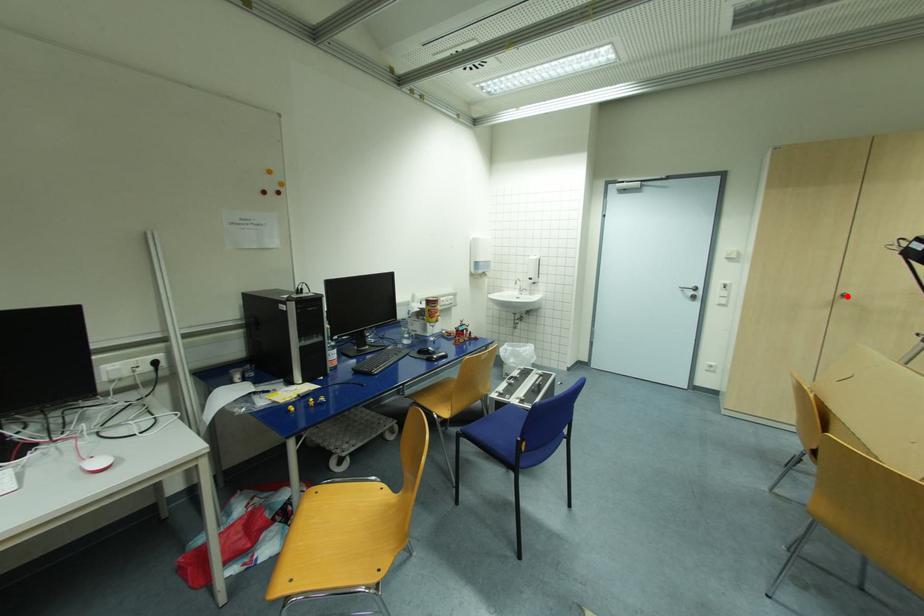
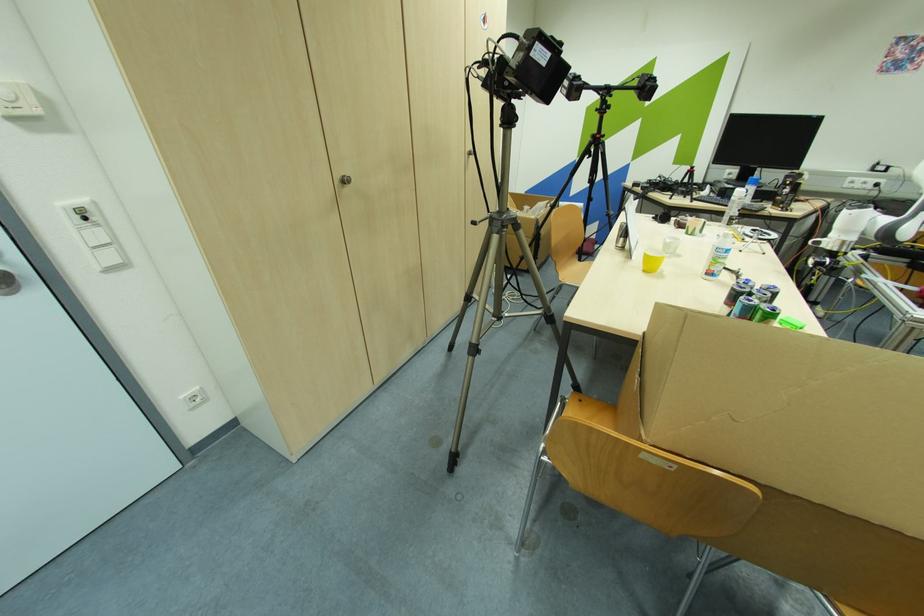
Question: A red point is marked in image1. In image2, is the corresponding 3D point closer to the camera or farther? Reply with the corresponding letter.

Choices:
 (A) The corresponding 3D point is closer.
 (B) The corresponding 3D point is farther.

Answer: (A)